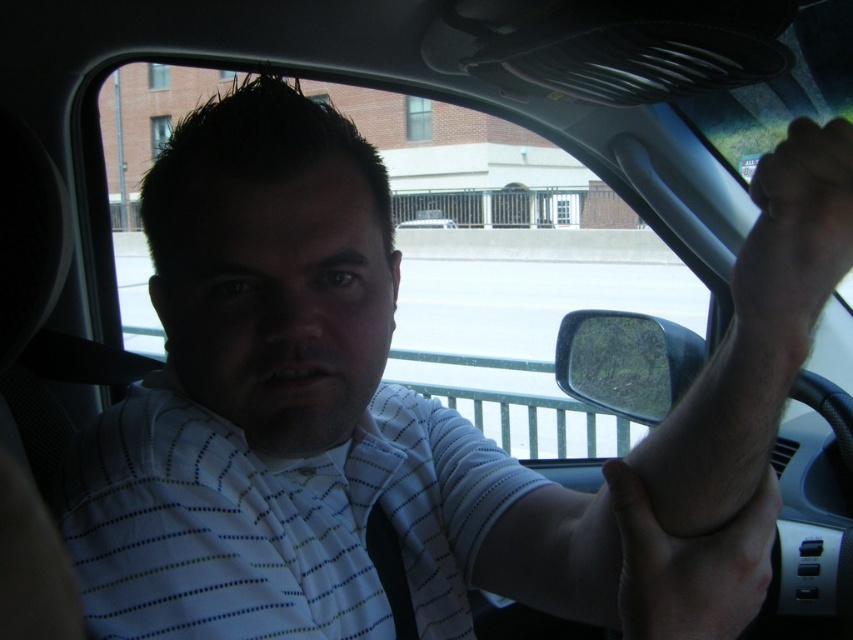
Based on the scene description, where is the smooth skin hand at center located in terms of coordinates?

The smooth skin hand at center is located at coordinates point (689, 564).

Based on the scene description, which object takes up more area in the image? The smooth skin hand at center or the clear plastic side mirror at right?

The clear plastic side mirror at right takes up more area in the image than the smooth skin hand at center because the smooth skin hand at center occupies less space than clear plastic side mirror at right.